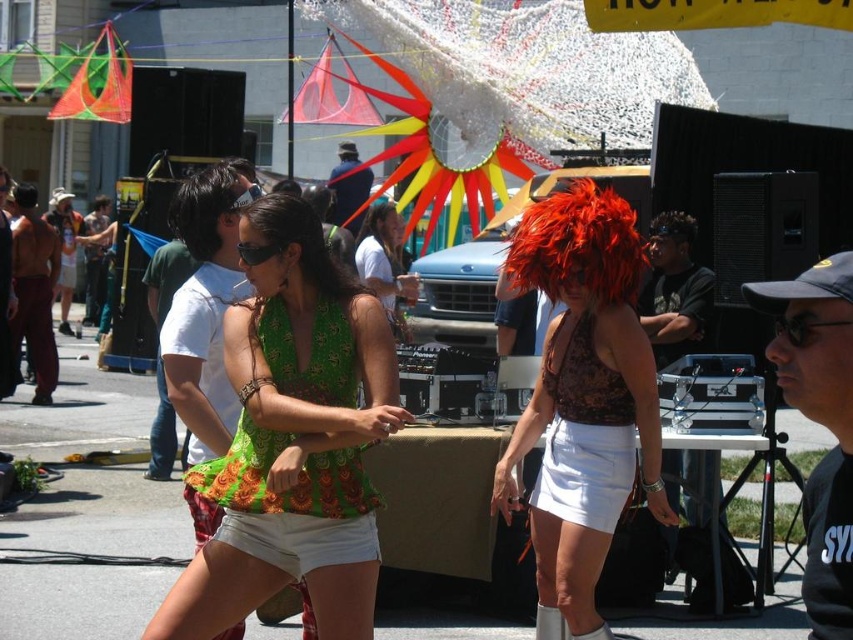
What do you see at coordinates (582, 400) in the screenshot? This screenshot has height=640, width=853. I see `shiny red wig at center` at bounding box center [582, 400].

What do you see at coordinates (582, 400) in the screenshot? The image size is (853, 640). I see `shiny red wig at center` at bounding box center [582, 400].

Image resolution: width=853 pixels, height=640 pixels. Find the location of `shiny red wig at center`. shiny red wig at center is located at coordinates (582, 400).

Is shiny red wig at center bigger than green floral dress at center?

No.

Between shiny red wig at center and green floral dress at center, which one has less height?

Standing shorter between the two is shiny red wig at center.

I want to click on shiny red wig at center, so click(582, 400).

Who is shorter, green floral blouse at center or shiny red wig at center?

With less height is shiny red wig at center.

Which is behind, point (270, 464) or point (602, 534)?

The point (602, 534) is more distant.

Does point (279, 561) come in front of point (573, 440)?

Yes, point (279, 561) is in front of point (573, 440).

This screenshot has width=853, height=640. What are the coordinates of `green floral blouse at center` in the screenshot? It's located at (293, 438).